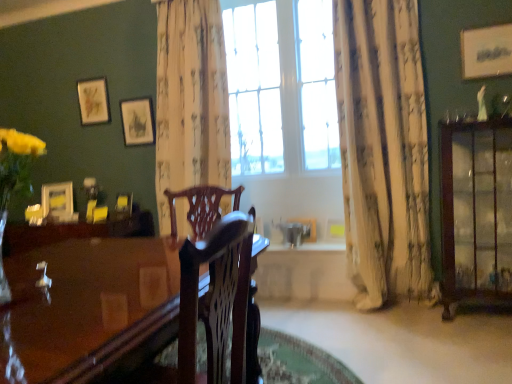
Question: Is wooden picture frame at center, the sixth picture frame positioned from the top, smaller than glossy wood table at center?

Choices:
 (A) yes
 (B) no

Answer: (A)

Question: From a real-world perspective, does wooden picture frame at center, which is the third picture frame in front-to-back order, stand above glossy wood table at center?

Choices:
 (A) no
 (B) yes

Answer: (B)

Question: Is wooden picture frame at center, the third picture frame from the right, at the right side of glossy wood table at center?

Choices:
 (A) yes
 (B) no

Answer: (A)

Question: Is the depth of wooden picture frame at center, the third picture frame from the right, greater than that of glossy wood table at center?

Choices:
 (A) yes
 (B) no

Answer: (A)

Question: Does wooden picture frame at center, acting as the fourth picture frame starting from the left, have a greater width compared to glossy wood table at center?

Choices:
 (A) yes
 (B) no

Answer: (B)

Question: Is white floral fabric curtain at center, placed as the first curtain when sorted from left to right, bigger or smaller than matte gold picture frame at upper left, the fifth picture frame when ordered from right to left?

Choices:
 (A) big
 (B) small

Answer: (A)

Question: Relative to matte gold picture frame at upper left, which ranks as the 2th picture frame in top-to-bottom order, is white floral fabric curtain at center, placed as the first curtain when sorted from left to right, in front or behind?

Choices:
 (A) front
 (B) behind

Answer: (A)

Question: Is white floral fabric curtain at center, placed as the first curtain when sorted from left to right, wider or thinner than matte gold picture frame at upper left, which appears as the fifth picture frame when ordered from the bottom?

Choices:
 (A) wide
 (B) thin

Answer: (A)

Question: Is white floral fabric curtain at center, the second curtain in the right-to-left sequence, taller or shorter than matte gold picture frame at upper left, which is the 1th picture frame in back-to-front order?

Choices:
 (A) short
 (B) tall

Answer: (B)

Question: From their relative heights in the image, would you say glossy wood table at center is taller or shorter than yellow paper picture frame at center, which appears as the 2th picture frame when viewed from the front?

Choices:
 (A) short
 (B) tall

Answer: (B)

Question: Do you think glossy wood table at center is within yellow paper picture frame at center, which appears as the 2th picture frame when viewed from the front, or outside of it?

Choices:
 (A) outside
 (B) inside

Answer: (A)

Question: Is glossy wood table at center bigger or smaller than yellow paper picture frame at center, marked as the 5th picture frame in a back-to-front arrangement?

Choices:
 (A) big
 (B) small

Answer: (A)

Question: From the image's perspective, is glossy wood table at center located above or below yellow paper picture frame at center, arranged as the 5th picture frame when viewed from the top?

Choices:
 (A) above
 (B) below

Answer: (B)

Question: In terms of height, does white paper at upper right, which is the first picture frame from front to back, look taller or shorter compared to yellow paper picture frame at center, the 2th picture frame when ordered from bottom to top?

Choices:
 (A) tall
 (B) short

Answer: (A)

Question: Considering the positions of white paper at upper right, marked as the 6th picture frame in a back-to-front arrangement, and yellow paper picture frame at center, which is the 2th picture frame from right to left, in the image, is white paper at upper right, marked as the 6th picture frame in a back-to-front arrangement, wider or thinner than yellow paper picture frame at center, which is the 2th picture frame from right to left,?

Choices:
 (A) thin
 (B) wide

Answer: (A)